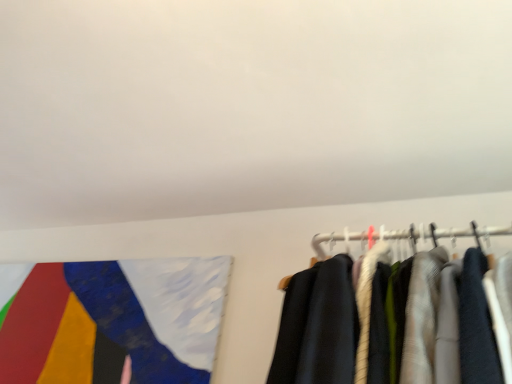
This screenshot has width=512, height=384. What are the coordinates of `white matte wall at upper center` in the screenshot? It's located at (247, 106).

Consider the image. In order to face white matte wall at upper center, should I rotate leftwards or rightwards?

To face it directly, rotate left by 18.093 degrees.

Describe the element at coordinates (247, 106) in the screenshot. I see `white matte wall at upper center` at that location.

The width and height of the screenshot is (512, 384). What do you see at coordinates (111, 320) in the screenshot?
I see `painted fabric flag at upper left` at bounding box center [111, 320].

The width and height of the screenshot is (512, 384). In order to click on painted fabric flag at upper left in this screenshot , I will do `click(111, 320)`.

Identify the location of white matte wall at upper center. This screenshot has height=384, width=512. (247, 106).

Is painted fabric flag at upper left at the left side of white matte wall at upper center?

Yes, painted fabric flag at upper left is to the left of white matte wall at upper center.

Considering the positions of objects painted fabric flag at upper left and white matte wall at upper center in the image provided, who is behind, painted fabric flag at upper left or white matte wall at upper center?

painted fabric flag at upper left is more distant.

Is point (121, 288) more distant than point (335, 33)?

Yes, it is behind point (335, 33).

From the image's perspective, is painted fabric flag at upper left over white matte wall at upper center?

No, from the image's perspective, painted fabric flag at upper left is not over white matte wall at upper center.

From a real-world perspective, which is physically above, painted fabric flag at upper left or white matte wall at upper center?

white matte wall at upper center.

In terms of width, does painted fabric flag at upper left look wider or thinner when compared to white matte wall at upper center?

Clearly, painted fabric flag at upper left has less width compared to white matte wall at upper center.

Does painted fabric flag at upper left have a lesser height compared to white matte wall at upper center?

No.

Is painted fabric flag at upper left smaller than white matte wall at upper center?

Yes.

Is painted fabric flag at upper left inside the boundaries of white matte wall at upper center, or outside?

painted fabric flag at upper left is outside white matte wall at upper center.

Is painted fabric flag at upper left far from white matte wall at upper center?

painted fabric flag at upper left is near white matte wall at upper center, not far away.

Is painted fabric flag at upper left aimed at white matte wall at upper center?

No, painted fabric flag at upper left does not turn towards white matte wall at upper center.

This screenshot has height=384, width=512. In order to click on flag beneath the white matte wall at upper center (from a real-world perspective) in this screenshot , I will do `click(111, 320)`.

Based on their positions, is white matte wall at upper center located to the left or right of painted fabric flag at upper left?

Clearly, white matte wall at upper center is on the right of painted fabric flag at upper left in the image.

Consider the image. Does white matte wall at upper center lie behind painted fabric flag at upper left?

No, it is in front of painted fabric flag at upper left.

Which is nearer, (509, 75) or (36, 324)?

Point (509, 75) is closer to the camera than point (36, 324).

From the image's perspective, does white matte wall at upper center appear lower than painted fabric flag at upper left?

Incorrect, from the image's perspective, white matte wall at upper center is higher than painted fabric flag at upper left.

From a real-world perspective, does white matte wall at upper center stand above painted fabric flag at upper left?

Yes, from a real-world perspective, white matte wall at upper center is over painted fabric flag at upper left

Is white matte wall at upper center wider or thinner than painted fabric flag at upper left?

white matte wall at upper center is wider than painted fabric flag at upper left.

Does white matte wall at upper center have a lesser height compared to painted fabric flag at upper left?

Correct, white matte wall at upper center is not as tall as painted fabric flag at upper left.

Is white matte wall at upper center bigger or smaller than painted fabric flag at upper left?

Considering their sizes, white matte wall at upper center takes up more space than painted fabric flag at upper left.

Can painted fabric flag at upper left be found inside white matte wall at upper center?

Answer: Actually, painted fabric flag at upper left is outside white matte wall at upper center.

Based on the photo, is white matte wall at upper center in contact with painted fabric flag at upper left?

No, white matte wall at upper center is not making contact with painted fabric flag at upper left.

Is white matte wall at upper center facing away from painted fabric flag at upper left?

No.

How many degrees apart are the facing directions of white matte wall at upper center and painted fabric flag at upper left?

89.5 degrees separate the facing orientations of white matte wall at upper center and painted fabric flag at upper left.

The image size is (512, 384). Find the location of `backdrop that appears above the painted fabric flag at upper left (from a real-world perspective)`. backdrop that appears above the painted fabric flag at upper left (from a real-world perspective) is located at coordinates (247, 106).

Find the location of `flag that appears below the white matte wall at upper center (from a real-world perspective)`. flag that appears below the white matte wall at upper center (from a real-world perspective) is located at coordinates (111, 320).

The image size is (512, 384). What are the coordinates of `flag behind the white matte wall at upper center` in the screenshot? It's located at (111, 320).